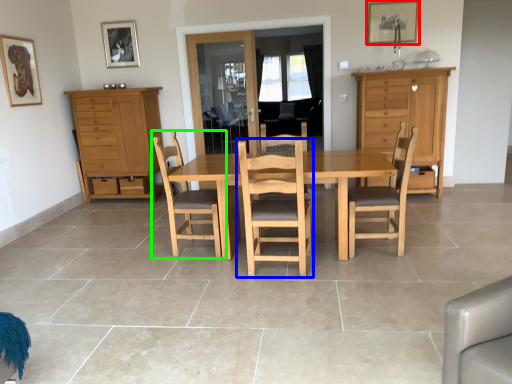
Question: Which object is positioned closest to picture frame (highlighted by a red box)? Select from chair (highlighted by a blue box) and chair (highlighted by a green box).

Choices:
 (A) chair
 (B) chair

Answer: (A)